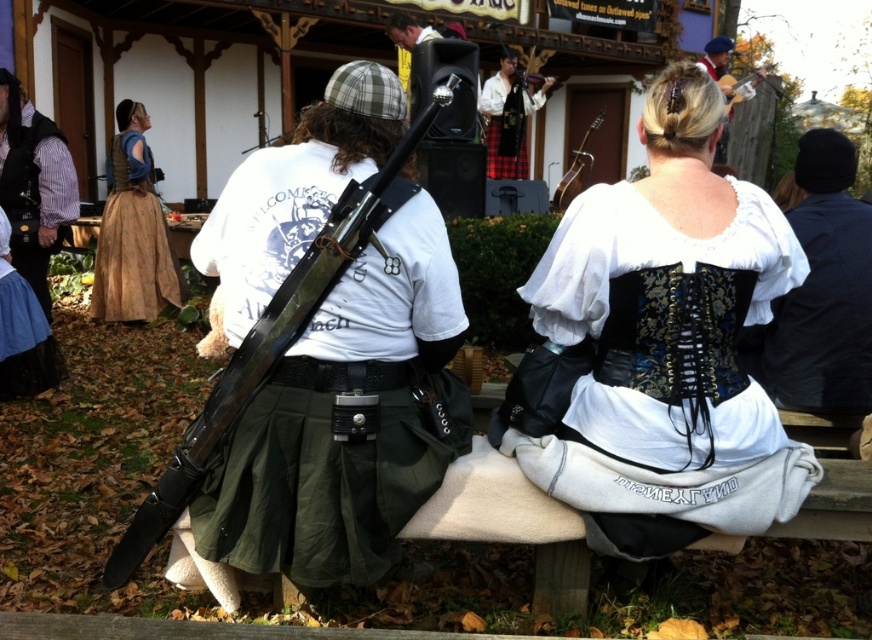
Between point (835, 387) and point (19, 118), which one is positioned behind?

Point (19, 118)

Can you confirm if black fabric jacket at right is taller than striped cotton shirt at left?

Incorrect, black fabric jacket at right's height is not larger of striped cotton shirt at left's.

Who is more forward, (836, 173) or (17, 230)?

Positioned in front is point (836, 173).

Locate an element on the screen. black fabric jacket at right is located at coordinates (821, 292).

Which of these two, striped cotton shirt at left or plaid fabric kilt at center, stands taller?

striped cotton shirt at left

Find the location of a particular element. The image size is (872, 640). striped cotton shirt at left is located at coordinates (33, 184).

Which is in front, point (65, 188) or point (532, 106)?

Point (65, 188) is more forward.

This screenshot has width=872, height=640. I want to click on striped cotton shirt at left, so click(x=33, y=184).

Can you confirm if black fabric jacket at right is positioned to the right of plaid fabric kilt at center?

Indeed, black fabric jacket at right is positioned on the right side of plaid fabric kilt at center.

Can you confirm if black fabric jacket at right is wider than plaid fabric kilt at center?

Yes.

The height and width of the screenshot is (640, 872). What do you see at coordinates (821, 292) in the screenshot?
I see `black fabric jacket at right` at bounding box center [821, 292].

You are a GUI agent. You are given a task and a screenshot of the screen. Output one action in this format:
    pyautogui.click(x=<x>, y=<y>)
    Task: Click on the black fabric jacket at right
    The width and height of the screenshot is (872, 640).
    Given the screenshot: What is the action you would take?
    pyautogui.click(x=821, y=292)